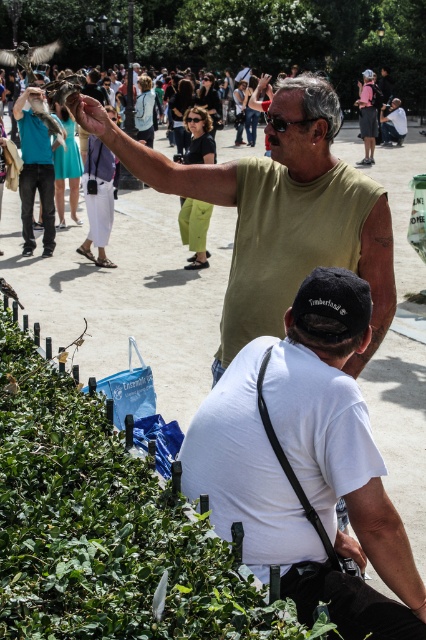
You are a photographer trying to capture both the green leafy hedge at lower left and the green matte tank top at upper center in the same frame. Which object should you focus on first to ensure both are in the frame?

You should focus on the green leafy hedge at lower left first because it is larger than the green matte tank top at upper center, so it will take up more space in the frame.

You are a photographer planning to take a group photo of the green leafy hedge at lower left and the matte black shirt at upper center. Which object should you focus on first if you want to capture both in the same frame without moving the camera?

The green leafy hedge at lower left is larger in size than the matte black shirt at upper center, so you should focus on the green leafy hedge at lower left first to ensure it fills the frame appropriately before adjusting for the smaller matte black shirt at upper center.

You are a photographer trying to capture a photo of the green leafy hedge at lower left and the green matte tank top at upper center. Which object is located lower in the frame?

The green leafy hedge at lower left is positioned under the green matte tank top at upper center, so it is located lower in the frame.